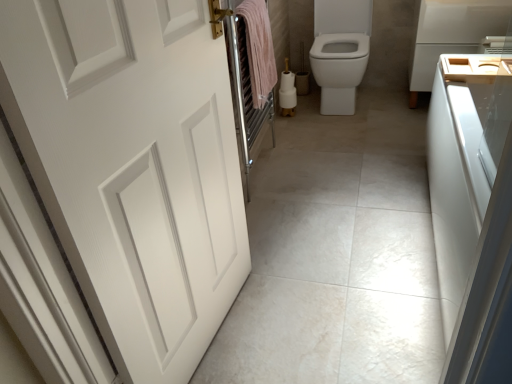
The height and width of the screenshot is (384, 512). What do you see at coordinates (339, 69) in the screenshot?
I see `white glossy bidet at center` at bounding box center [339, 69].

Describe the element at coordinates (133, 166) in the screenshot. I see `white matte door at left` at that location.

At what (x,y) coordinates should I click in order to perform the action: click on white glossy bidet at center. Please return your answer as a coordinate pair (x, y). The image size is (512, 384). Looking at the image, I should click on (339, 69).

Consider the image. Is white matte door at left outside of wooden sink at right?

white matte door at left is positioned outside wooden sink at right.

Is white matte door at left at the right side of wooden sink at right?

Incorrect, white matte door at left is not on the right side of wooden sink at right.

From a real-world perspective, who is located lower, white matte door at left or wooden sink at right?

In real-world perspective, wooden sink at right is lower.

I want to click on door that appears in front of the white glossy bidet at center, so click(133, 166).

Does white matte door at left turn towards white glossy bidet at center?

No, white matte door at left is not aimed at white glossy bidet at center.

Consider the image. Are white matte door at left and white glossy bidet at center far apart?

Yes, white matte door at left is far from white glossy bidet at center.

Which object is further away from the camera, wooden tray at right or white matte door at left?

wooden tray at right is further away from the camera.

Between wooden tray at right and white matte door at left, which one has larger width?

With larger width is wooden tray at right.

Does point (454, 4) come farther from viewer compared to point (180, 302)?

Yes, point (454, 4) is farther from viewer.

Does pink cotton towel at center contain white matte door at left?

No, white matte door at left is not inside pink cotton towel at center.

Considering the sizes of objects pink cotton towel at center and white matte door at left in the image provided, who is shorter, pink cotton towel at center or white matte door at left?

With less height is pink cotton towel at center.

Does pink cotton towel at center have a smaller size compared to white matte door at left?

Correct, pink cotton towel at center occupies less space than white matte door at left.

What's the angular difference between pink cotton towel at center and white matte door at left's facing directions?

6.67 degrees.

Does wooden tray at right have a greater height compared to wooden sink at right?

Correct, wooden tray at right is much taller as wooden sink at right.

Considering the sizes of objects wooden tray at right and wooden sink at right in the image provided, who is thinner, wooden tray at right or wooden sink at right?

With smaller width is wooden sink at right.

Is wooden tray at right at the left side of wooden sink at right?

Incorrect, wooden tray at right is not on the left side of wooden sink at right.

Identify the location of appliance behind the wooden sink at right. (452, 34).

Is white matte door at left to the right of pink cotton towel at center from the viewer's perspective?

In fact, white matte door at left is to the left of pink cotton towel at center.

What's the angular difference between white matte door at left and pink cotton towel at center's facing directions?

6.67 degrees.

Is white matte door at left surrounding pink cotton towel at center?

No, pink cotton towel at center is not a part of white matte door at left.

From their relative heights in the image, would you say white matte door at left is taller or shorter than pink cotton towel at center?

white matte door at left is taller than pink cotton towel at center.

Can you confirm if white glossy bidet at center is wider than pink cotton towel at center?

Yes, white glossy bidet at center is wider than pink cotton towel at center.

In the scene shown: Looking at the image, does white glossy bidet at center seem bigger or smaller compared to pink cotton towel at center?

white glossy bidet at center is bigger than pink cotton towel at center.

From the image's perspective, is white glossy bidet at center located beneath pink cotton towel at center?

No.

Would you say white glossy bidet at center is a long distance from pink cotton towel at center?

white glossy bidet at center is near pink cotton towel at center, not far away.

Where is `sink that appears above the white matte door at left (from the image's perspective)`? This screenshot has width=512, height=384. sink that appears above the white matte door at left (from the image's perspective) is located at coordinates (475, 66).

Where is `bidet lying behind the white matte door at left`? Image resolution: width=512 pixels, height=384 pixels. bidet lying behind the white matte door at left is located at coordinates (339, 69).

Which object lies nearer to the anchor point pink cotton towel at center, white glossy bidet at center or wooden sink at right?

white glossy bidet at center is positioned closer to the anchor pink cotton towel at center.

When comparing their distances from wooden sink at right, does wooden tray at right or white matte door at left seem closer?

Based on the image, wooden tray at right appears to be nearer to wooden sink at right.

Consider the image. Which object lies further to the anchor point pink cotton towel at center, wooden sink at right or wooden tray at right?

wooden tray at right is positioned further to the anchor pink cotton towel at center.

Which object lies nearer to the anchor point white matte door at left, wooden tray at right or pink cotton towel at center?

pink cotton towel at center lies closer to white matte door at left than the other object.

Considering their positions, is white matte door at left positioned further to white glossy bidet at center than pink cotton towel at center?

white matte door at left.

Estimate the real-world distances between objects in this image. Which object is further from white glossy bidet at center, white matte door at left or wooden tray at right?

Based on the image, white matte door at left appears to be further to white glossy bidet at center.

When comparing their distances from white glossy bidet at center, does wooden tray at right or wooden sink at right seem closer?

wooden tray at right.

From the image, which object appears to be farther from white matte door at left, wooden tray at right or white glossy bidet at center?

wooden tray at right is further to white matte door at left.

Locate an element on the screen. The height and width of the screenshot is (384, 512). sink between white matte door at left and pink cotton towel at center in the front-back direction is located at coordinates [475, 66].

You are a GUI agent. You are given a task and a screenshot of the screen. Output one action in this format:
    pyautogui.click(x=<x>, y=<y>)
    Task: Click on the bath towel between white matte door at left and wooden tray at right along the z-axis
    
    Given the screenshot: What is the action you would take?
    pyautogui.click(x=259, y=49)

You are a GUI agent. You are given a task and a screenshot of the screen. Output one action in this format:
    pyautogui.click(x=<x>, y=<y>)
    Task: Click on the sink between white matte door at left and white glossy bidet at center along the z-axis
    The width and height of the screenshot is (512, 384).
    Given the screenshot: What is the action you would take?
    pyautogui.click(x=475, y=66)

You are a GUI agent. You are given a task and a screenshot of the screen. Output one action in this format:
    pyautogui.click(x=<x>, y=<y>)
    Task: Click on the bath towel positioned between white matte door at left and white glossy bidet at center from near to far
    The height and width of the screenshot is (384, 512).
    Given the screenshot: What is the action you would take?
    pyautogui.click(x=259, y=49)